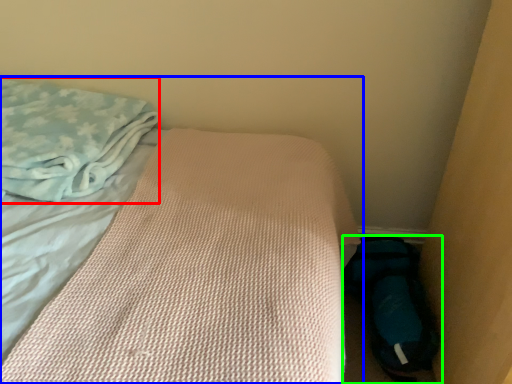
Question: Based on their relative distances, which object is nearer to cloth (highlighted by a red box)? Choose from bed (highlighted by a blue box) and footwear (highlighted by a green box).

Choices:
 (A) bed
 (B) footwear

Answer: (A)